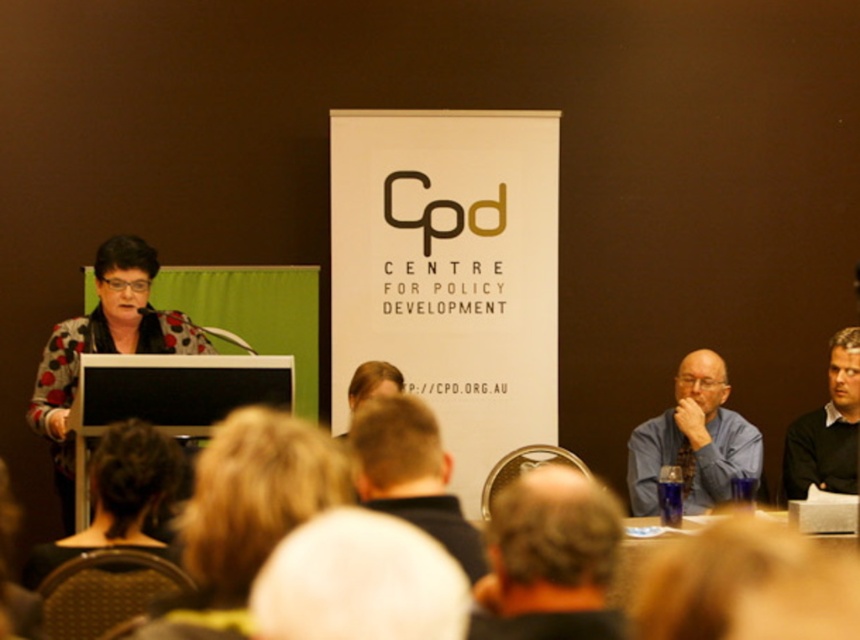
You are attending a conference and want to take a photo of the speaker. The speaker is wearing a polka dot sweater at left. Where should you stand to capture the speaker clearly in your photo?

To capture the speaker wearing the polka dot sweater at left clearly, you should position yourself in the foreground facing the stage where the polka dot sweater at left is located. Since the audience is blurred in the foreground, moving closer to the stage would allow for a clearer shot of the speaker.

You are attending a conference and need to place a notebook on the surface between the polka dot sweater at left and the matte black laptop at left. Can the notebook fit horizontally between them?

The polka dot sweater at left has a greater height compared to matte black laptop at left. Since the sweater is taller, it might block the space between them, making it difficult to place the notebook horizontally. However, the exact horizontal space isn

You are standing at the back of the conference hall and want to walk to the stage. There are two points marked on the floor, point A at coordinates point (x=568, y=634) and point B at coordinates point (x=392, y=401). Which point should you walk towards to get closer to the stage?

Point A at coordinates point (x=568, y=634) is in front of point B at coordinates point (x=392, y=401), so walking towards point A will get you closer to the stage.